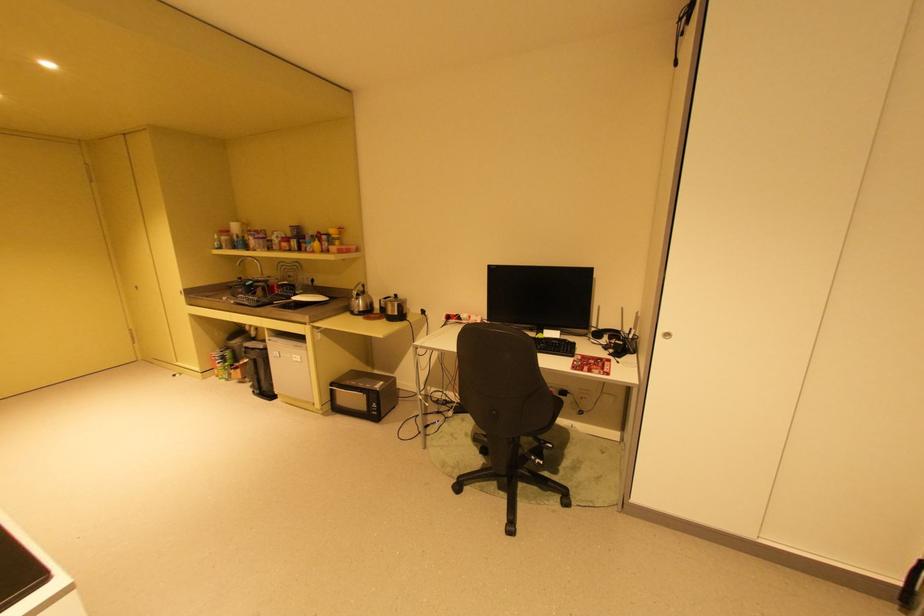
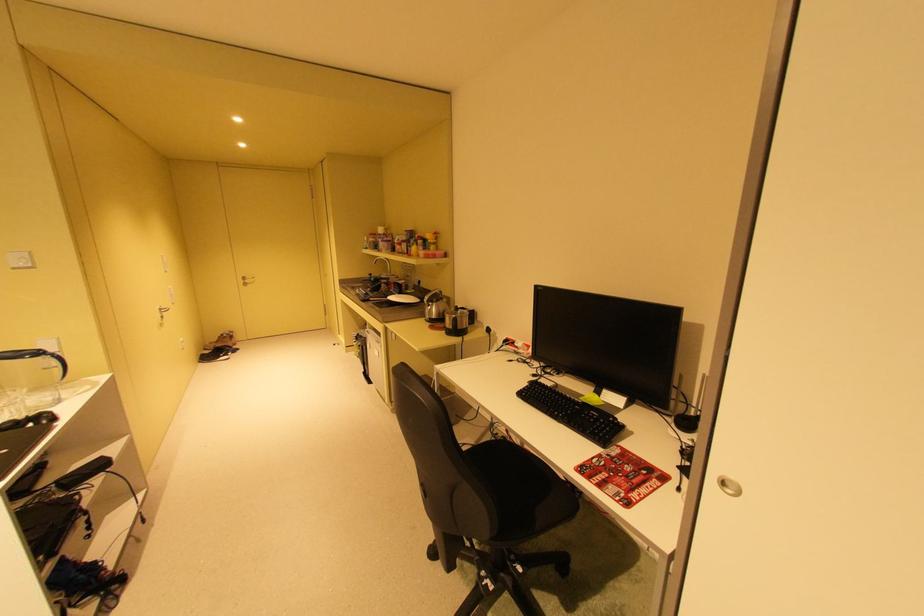
The point at (404, 314) is marked in the first image. Where is the corresponding point in the second image?

(460, 328)